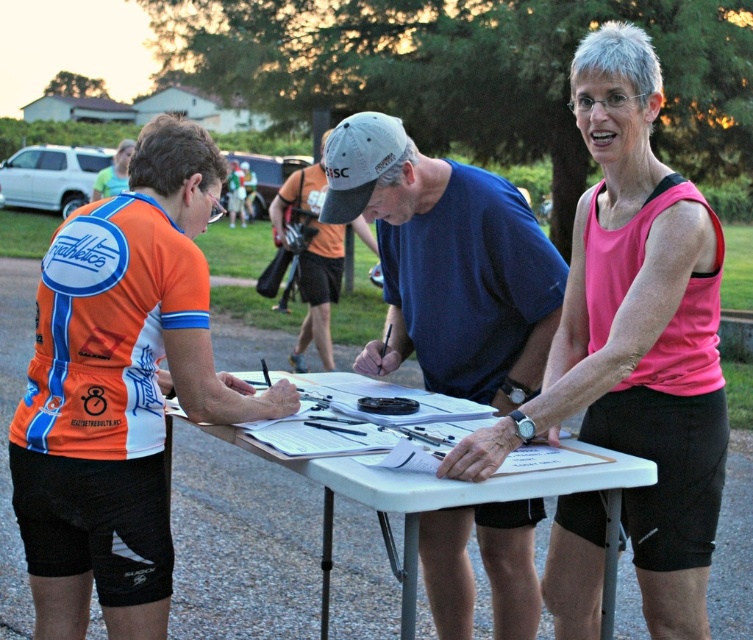
You are organizing a charity event and need to display two shirts on a stand. The pink fabric tank top at center and the orange mesh shirt at center. Which shirt should you choose if you want the one that is wider?

The pink fabric tank top at center is wider than the orange mesh shirt at center, so you should choose the pink fabric tank top at center for the display.